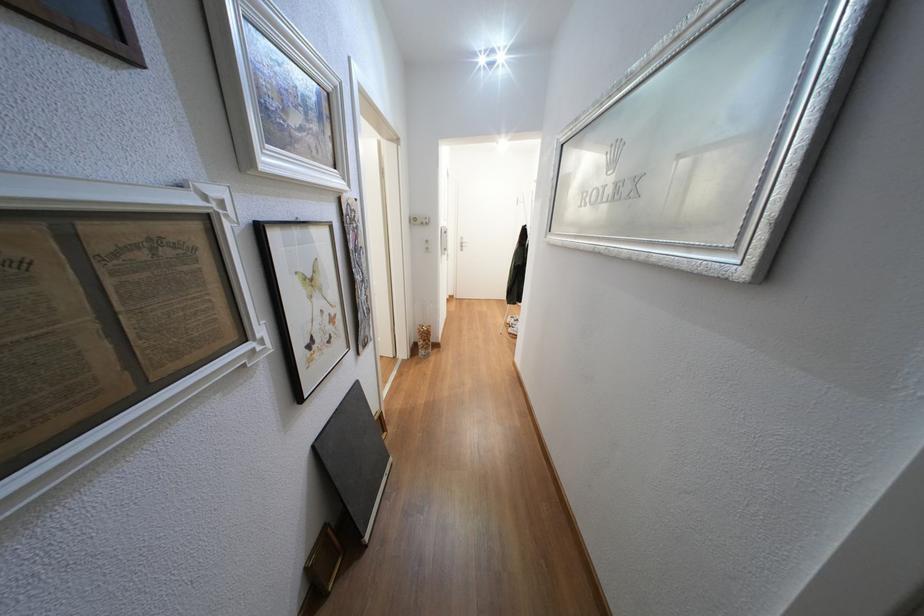
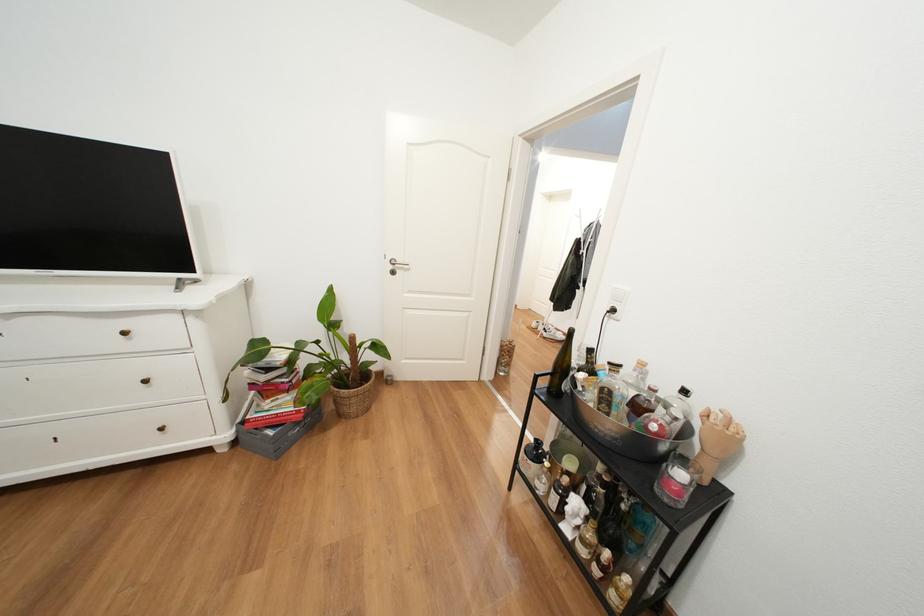
Question: In a continuous first-person perspective shot, in which direction is the camera moving?

Choices:
 (A) Left
 (B) Right
 (C) Forward
 (D) Backward

Answer: (A)